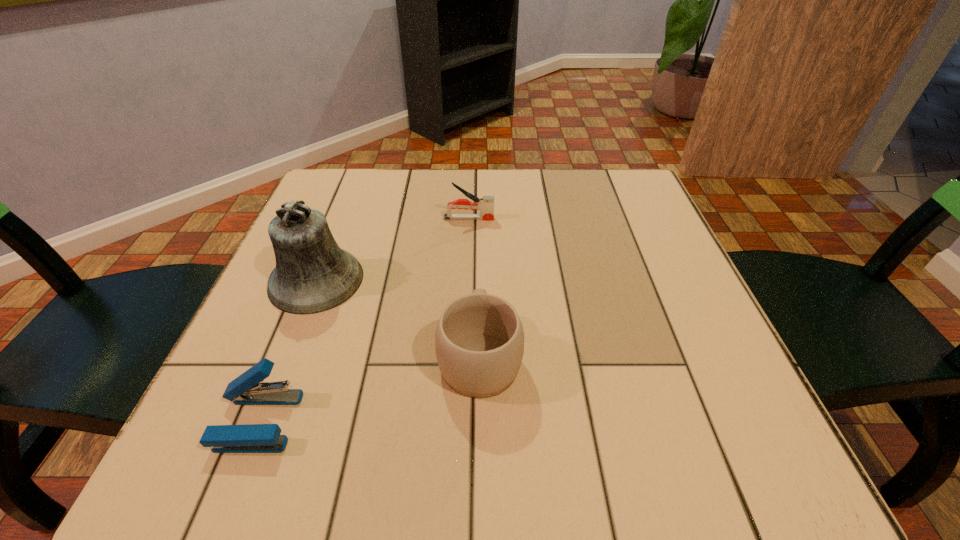
Find the location of `the second farthest object`. the second farthest object is located at coordinates (313, 274).

What are the coordinates of `the tallest object` in the screenshot? It's located at (313, 274).

You are a GUI agent. You are given a task and a screenshot of the screen. Output one action in this format:
    pyautogui.click(x=<x>, y=<y>)
    Task: Click on the mug
    The width and height of the screenshot is (960, 540).
    Given the screenshot: What is the action you would take?
    pyautogui.click(x=479, y=340)

You are a GUI agent. You are given a task and a screenshot of the screen. Output one action in this format:
    pyautogui.click(x=<x>, y=<y>)
    Task: Click on the farther stapler
    The width and height of the screenshot is (960, 540).
    Given the screenshot: What is the action you would take?
    pyautogui.click(x=486, y=204)

Identify the location of the right stapler. (486, 204).

The width and height of the screenshot is (960, 540). In order to click on the left stapler in this screenshot , I will do `click(246, 389)`.

Identify the location of free space located on the front of the second farthest object. Image resolution: width=960 pixels, height=540 pixels. (276, 384).

Find the location of a particular element. The height and width of the screenshot is (540, 960). free space located on the side of the mug with the handle is located at coordinates coord(480,272).

At what (x,y) coordinates should I click in order to perform the action: click on vacant area situated on the side of the mug with the handle. Please return your answer as a coordinate pair (x, y). The width and height of the screenshot is (960, 540). Looking at the image, I should click on (480, 220).

This screenshot has width=960, height=540. I want to click on vacant space located on the side of the mug with the handle, so click(x=480, y=242).